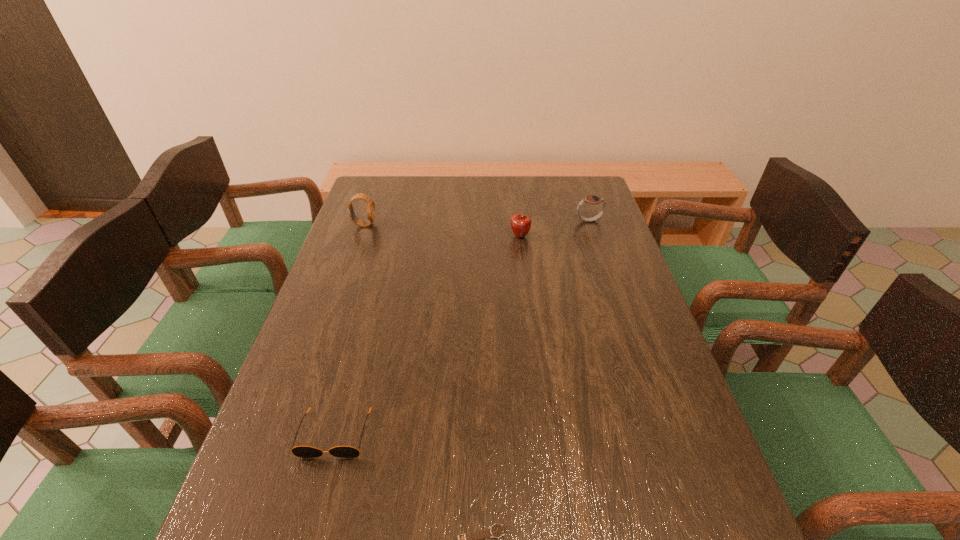
Find the location of a particular element. Image resolution: width=960 pixels, height=540 pixels. the tallest object is located at coordinates (370, 203).

Where is `the tallest watch`? The image size is (960, 540). the tallest watch is located at coordinates (370, 203).

Identify the location of the second shortest watch. This screenshot has height=540, width=960. (591, 199).

The image size is (960, 540). What are the coordinates of `the rightmost object` in the screenshot? It's located at (591, 199).

I want to click on the third farthest object, so click(520, 223).

The image size is (960, 540). Identify the location of the second object from right to left. (520, 223).

The width and height of the screenshot is (960, 540). I want to click on the second shortest object, so click(x=299, y=451).

Locate an element on the screen. The image size is (960, 540). the second nearest object is located at coordinates (299, 451).

You are a GUI agent. You are given a task and a screenshot of the screen. Output one action in this format:
    pyautogui.click(x=<x>, y=<y>)
    Task: Click on the vacant position located on the face of the tallest object
    The width and height of the screenshot is (960, 540).
    Given the screenshot: What is the action you would take?
    pyautogui.click(x=426, y=225)

In order to click on vacant space located 0.150m on the front of the rightmost object in this screenshot , I will do `click(600, 252)`.